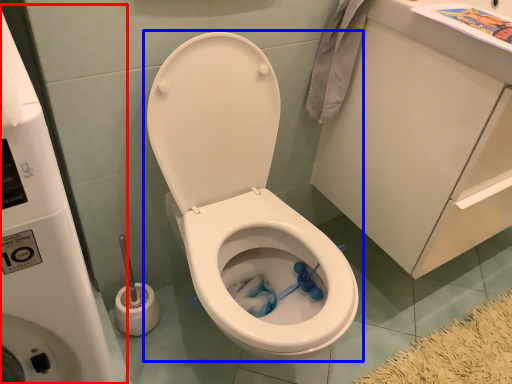
Question: Which point is further to the camera, water tank (highlighted by a red box) or toilet (highlighted by a blue box)?

Choices:
 (A) water tank
 (B) toilet

Answer: (B)